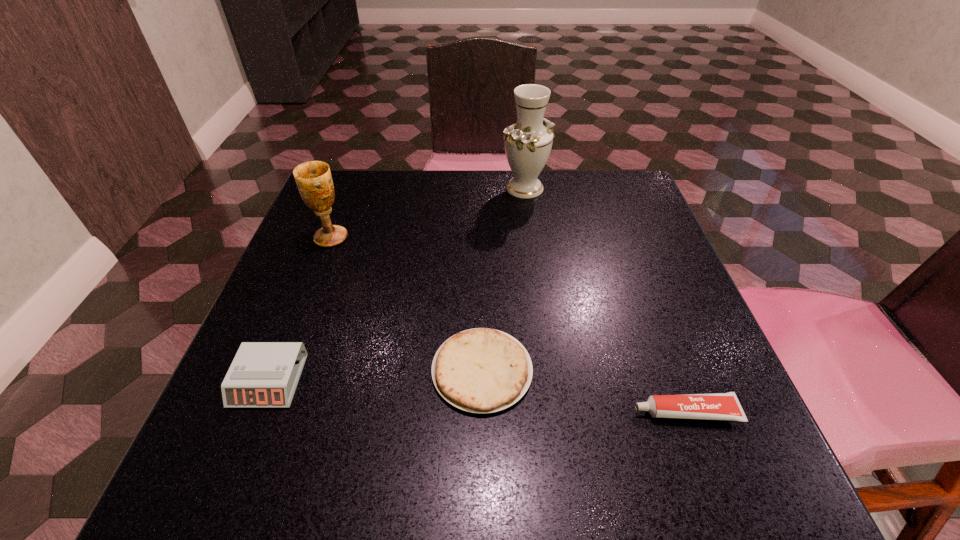
Where is `empty location between the rightmost object and the tortilla`? This screenshot has width=960, height=540. empty location between the rightmost object and the tortilla is located at coordinates (584, 391).

Locate an element on the screen. The height and width of the screenshot is (540, 960). free space between the tortilla and the third shortest object is located at coordinates (375, 375).

This screenshot has width=960, height=540. Find the location of `vacant space in between the shortest object and the second tallest object`. vacant space in between the shortest object and the second tallest object is located at coordinates (406, 304).

The height and width of the screenshot is (540, 960). Find the location of `vacant area between the third tallest object and the farthest object`. vacant area between the third tallest object and the farthest object is located at coordinates (396, 284).

This screenshot has height=540, width=960. I want to click on vacant space that's between the third tallest object and the tallest object, so click(396, 284).

Point out which object is positioned as the fourth nearest to the second tallest object. Please provide its 2D coordinates. Your answer should be formatted as a tuple, i.e. [(x, y)], where the tuple contains the x and y coordinates of a point satisfying the conditions above.

[(716, 406)]

The width and height of the screenshot is (960, 540). I want to click on object that stands as the third closest to the alarm clock, so click(x=716, y=406).

The height and width of the screenshot is (540, 960). In order to click on free spot that satisfies the following two spatial constraints: 1. on the back side of the third shortest object; 2. on the right side of the chalice in this screenshot , I will do `click(325, 238)`.